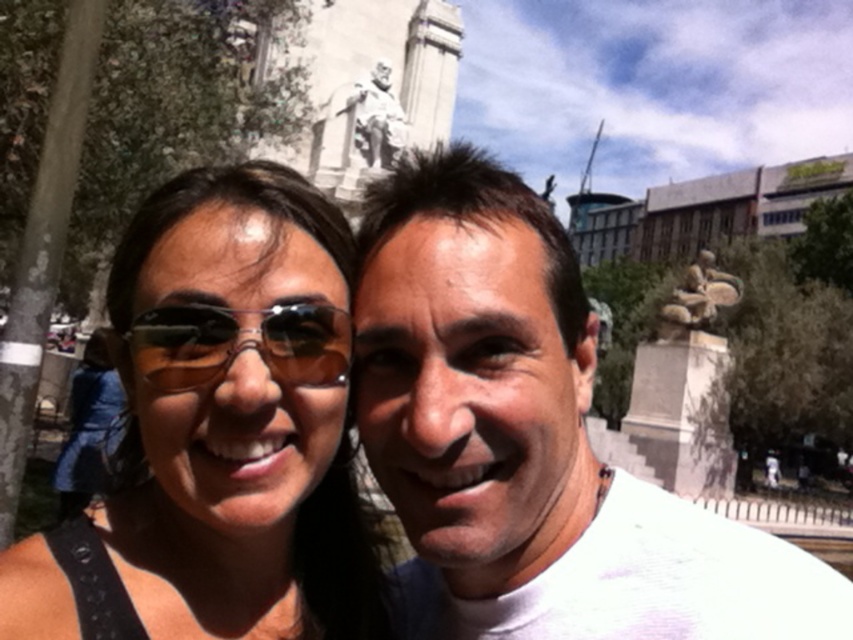
Question: Which of the following is the farthest from the observer?

Choices:
 (A) (578, 356)
 (B) (303, 246)

Answer: (A)

Question: Is white matte shirt at center closer to camera compared to matte black sunglasses at center?

Choices:
 (A) no
 (B) yes

Answer: (A)

Question: Which point is closer to the camera taking this photo?

Choices:
 (A) (459, 600)
 (B) (186, 368)

Answer: (B)

Question: From the image, what is the correct spatial relationship of white matte shirt at center in relation to shiny black sunglasses at center?

Choices:
 (A) above
 (B) below

Answer: (A)

Question: Which is nearer to the shiny black sunglasses at center?

Choices:
 (A) white matte shirt at center
 (B) matte black sunglasses at center

Answer: (B)

Question: In this image, where is matte black sunglasses at center located relative to shiny black sunglasses at center?

Choices:
 (A) right
 (B) left

Answer: (B)